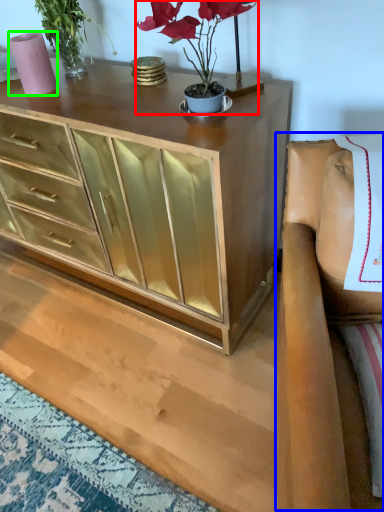
Question: Which is nearer to the houseplant (highlighted by a red box)? armchair (highlighted by a blue box) or vase (highlighted by a green box).

Choices:
 (A) armchair
 (B) vase

Answer: (A)